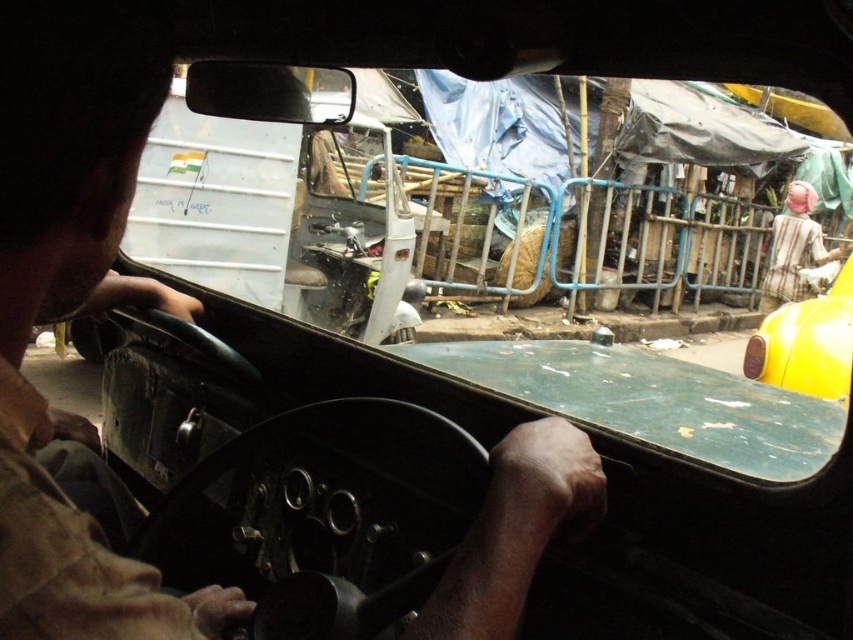
This screenshot has height=640, width=853. What do you see at coordinates (807, 342) in the screenshot?
I see `yellow matte taxi at right` at bounding box center [807, 342].

Describe the element at coordinates (807, 342) in the screenshot. I see `yellow matte taxi at right` at that location.

This screenshot has height=640, width=853. What are the coordinates of `yellow matte taxi at right` in the screenshot? It's located at (807, 342).